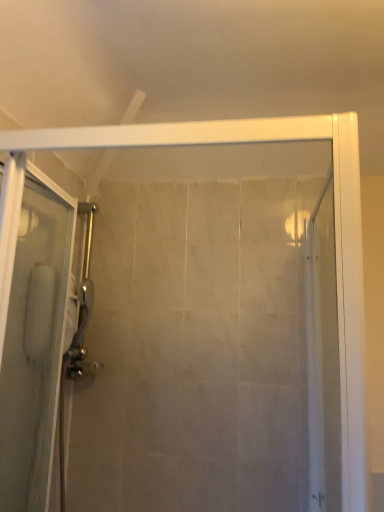
Measure the distance between white glossy door at left and camera.

white glossy door at left and camera are 36.22 inches apart.

I want to click on white glossy door at left, so click(x=34, y=344).

What do you see at coordinates (34, 344) in the screenshot? The height and width of the screenshot is (512, 384). I see `white glossy door at left` at bounding box center [34, 344].

Where is `white glossy door at left`? Image resolution: width=384 pixels, height=512 pixels. white glossy door at left is located at coordinates (34, 344).